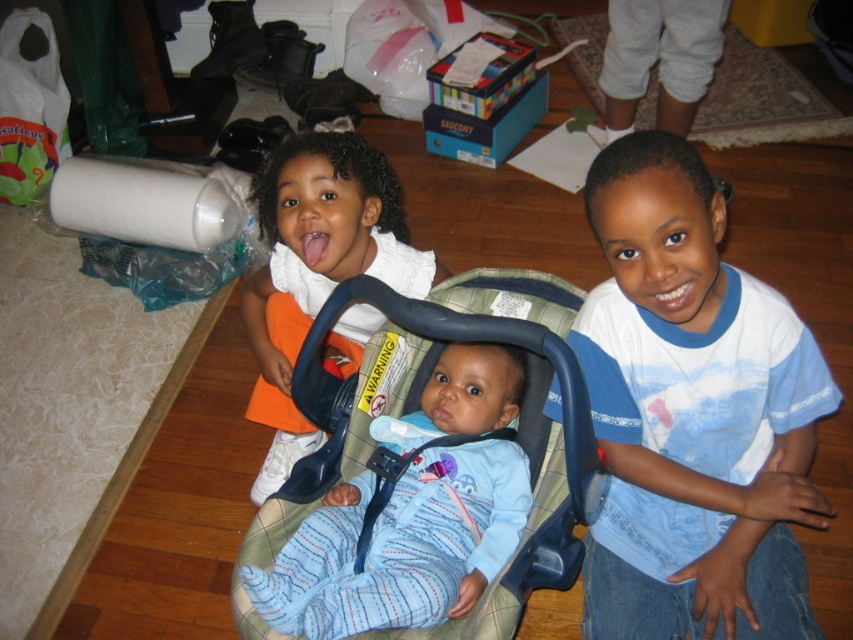
Question: Among these points, which one is nearest to the camera?

Choices:
 (A) (402, 316)
 (B) (434, 472)
 (C) (648, 244)
 (D) (341, 372)

Answer: (C)

Question: Does plaid fabric baby carriage at center appear under blue fabric strap at center?

Choices:
 (A) no
 (B) yes

Answer: (A)

Question: Is plaid fabric baby carriage at center in front of matte white shirt at upper left?

Choices:
 (A) no
 (B) yes

Answer: (B)

Question: Is blue cotton shirt at right above plaid fabric baby carriage at center?

Choices:
 (A) no
 (B) yes

Answer: (B)

Question: Which point is closer to the camera?

Choices:
 (A) 775,541
 (B) 305,412
 (C) 277,465

Answer: (B)

Question: Which point appears farthest from the camera in this image?

Choices:
 (A) 276,372
 (B) 650,168
 (C) 347,474
 (D) 462,438

Answer: (A)